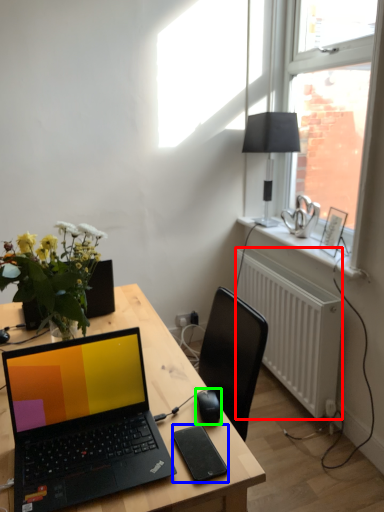
Question: Based on their relative distances, which object is farther from radiator (highlighted by a red box)? Choose from tablet computer (highlighted by a blue box) and computer mouse (highlighted by a green box).

Choices:
 (A) tablet computer
 (B) computer mouse

Answer: (A)